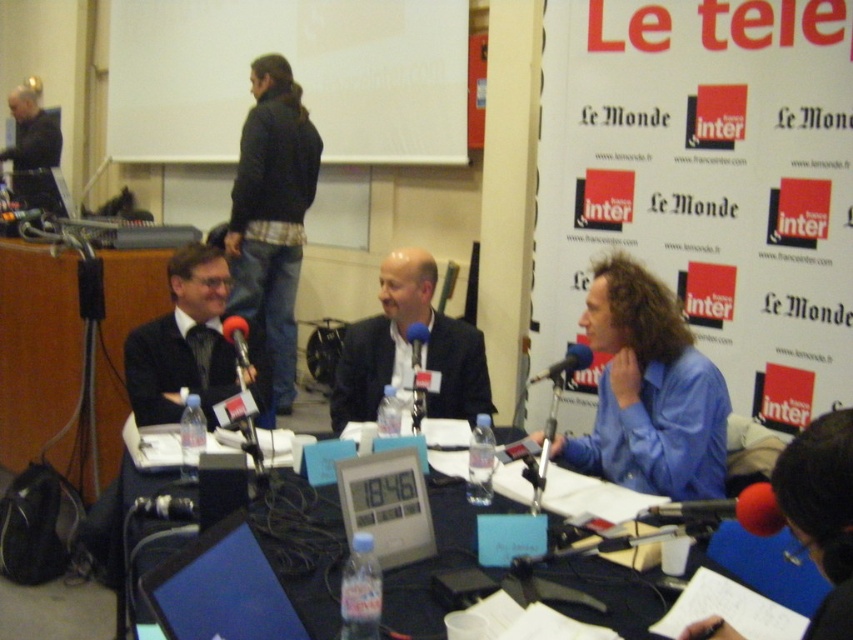
You are attending a press conference and need to place a name tag on the table. The name tag must be placed between the dark suit jacket at center and the shiny black laptop at center. Is there enough space between them for the name tag?

The dark suit jacket at center is located above the shiny black laptop at center, so there is space between them for the name tag.

You are standing in the room and want to place a small plant on the table. The table is represented by the point at coordinates point (305, 545). Can you confirm if the table is located at the center of the room?

The point (305, 545) corresponds to the black plastic table at center, so yes, the table is indeed located at the center of the room.

You are standing in the room where the press conference is happening. There is a point marked at coordinates (648, 392). Which object from the scene is this point located on?

The point at coordinates (648, 392) is located on the blue shirt at right.